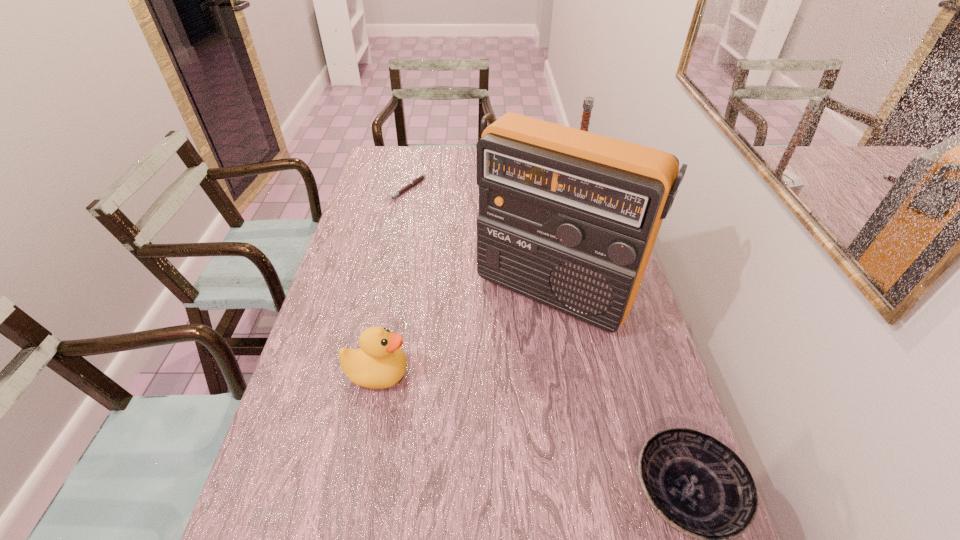
In order to click on vacant space on the desktop that is between the second nearest object and the fourth tallest object and is positioned on the front-facing side of the tallest object in this screenshot , I will do (x=470, y=411).

Where is `vacant spot on the desktop that is between the second nearest object and the bowl and is positioned on the striking surface of the hammer`? vacant spot on the desktop that is between the second nearest object and the bowl and is positioned on the striking surface of the hammer is located at coordinates (524, 434).

You are a GUI agent. You are given a task and a screenshot of the screen. Output one action in this format:
    pyautogui.click(x=<x>, y=<y>)
    Task: Click on the free spot on the desktop that is between the third tallest object and the bowl and is positioned at the nib of the pen
    
    Given the screenshot: What is the action you would take?
    pyautogui.click(x=558, y=448)